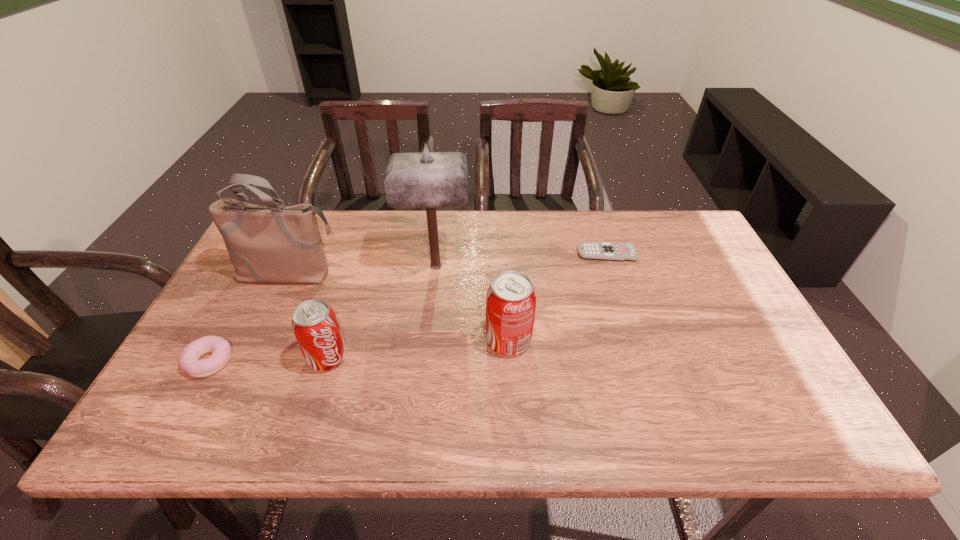
Find the location of a particular element. The height and width of the screenshot is (540, 960). empty space between the doughnut and the shorter soda is located at coordinates (269, 360).

Image resolution: width=960 pixels, height=540 pixels. What are the coordinates of `empty location between the mallet and the fifth object from left to right` in the screenshot? It's located at (472, 303).

Where is `unoccupied position between the doughnut and the taller soda`? Image resolution: width=960 pixels, height=540 pixels. unoccupied position between the doughnut and the taller soda is located at coordinates (359, 351).

The height and width of the screenshot is (540, 960). I want to click on blank region between the shortest object and the shoulder bag, so click(x=448, y=264).

Locate an element on the screen. vacant region between the fourth object from left to right and the fourth shortest object is located at coordinates (472, 303).

You are a GUI agent. You are given a task and a screenshot of the screen. Output one action in this format:
    pyautogui.click(x=<x>, y=<y>)
    Task: Click on the vacant area that lies between the left soda and the remote control
    The image size is (960, 540).
    Given the screenshot: What is the action you would take?
    pyautogui.click(x=467, y=306)

Locate an element on the screen. Image resolution: width=960 pixels, height=540 pixels. unoccupied area between the third tallest object and the shorter soda is located at coordinates (418, 349).

Locate an element on the screen. Image resolution: width=960 pixels, height=540 pixels. object that is the fifth nearest to the second tallest object is located at coordinates (613, 251).

Select which object is the closest to the second tallest object. Please provide its 2D coordinates. Your answer should be formatted as a tuple, i.e. [(x, y)], where the tuple contains the x and y coordinates of a point satisfying the conditions above.

[(430, 180)]